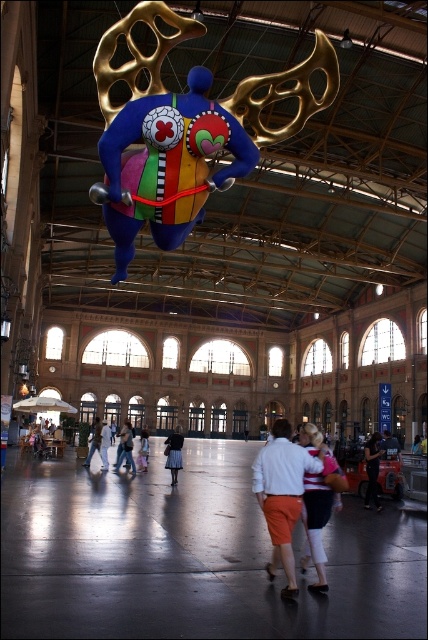
Question: Can you confirm if white cotton shirt at center is bigger than white cotton dress at center?

Choices:
 (A) yes
 (B) no

Answer: (B)

Question: Which point is closer to the camera?

Choices:
 (A) (172, 467)
 (B) (158, 61)

Answer: (B)

Question: Among these points, which one is farthest from the camera?

Choices:
 (A) (380, 506)
 (B) (106, 428)
 (C) (165, 442)

Answer: (C)

Question: Can you confirm if white cotton shirt at center is positioned to the left of white matte jacket at lower center?

Choices:
 (A) no
 (B) yes

Answer: (B)

Question: Is blue fabric balloon at center closer to the viewer compared to white matte jacket at lower center?

Choices:
 (A) yes
 (B) no

Answer: (B)

Question: Based on their relative distances, which object is nearer to the white matte jacket at lower center?

Choices:
 (A) white cotton skirt at center
 (B) dark blue jeans at center

Answer: (B)